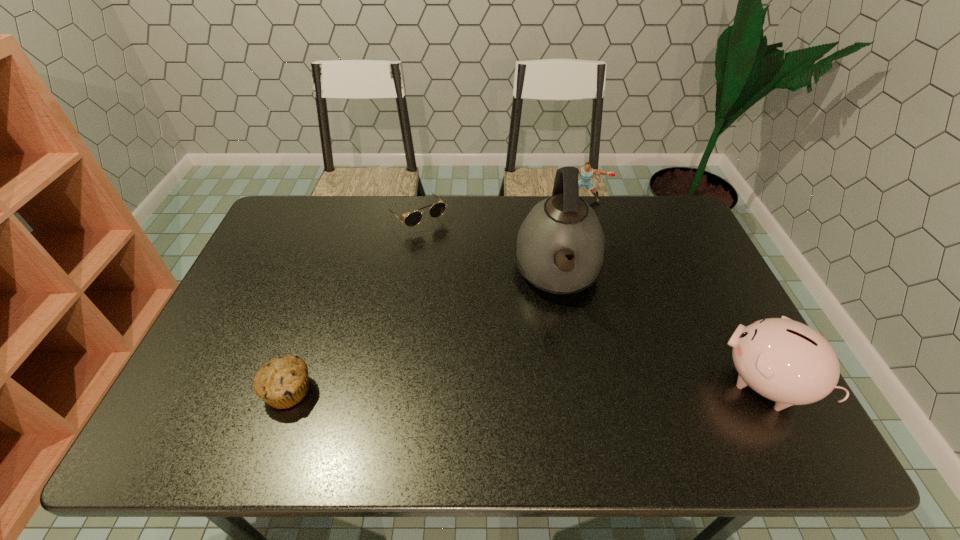
Where is `the leftmost object`? The height and width of the screenshot is (540, 960). the leftmost object is located at coordinates point(282,382).

At what (x,y) coordinates should I click in order to perform the action: click on piggy bank. Please return your answer as a coordinate pair (x, y). This screenshot has width=960, height=540. Looking at the image, I should click on (783, 360).

The height and width of the screenshot is (540, 960). What are the coordinates of `the fourth shortest object` in the screenshot? It's located at (783, 360).

Image resolution: width=960 pixels, height=540 pixels. Identify the location of the second object from left to right. (414, 218).

Locate an element on the screen. The image size is (960, 540). the shortest object is located at coordinates (414, 218).

In order to click on kettle in this screenshot , I will do `click(563, 226)`.

Image resolution: width=960 pixels, height=540 pixels. I want to click on the third shortest object, so click(586, 172).

Find the location of `free space located on the back of the muffin`. free space located on the back of the muffin is located at coordinates (313, 319).

Where is `free spot located 0.100m on the back of the piggy bank`? This screenshot has width=960, height=540. free spot located 0.100m on the back of the piggy bank is located at coordinates point(730,319).

Where is `free space located 0.290m on the front lenses of the shortest object`? The image size is (960, 540). free space located 0.290m on the front lenses of the shortest object is located at coordinates (481, 286).